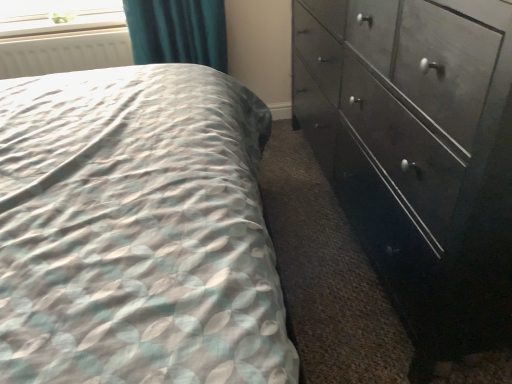
Question: Is dark wood dresser at right far from clear plastic window screen at upper left?

Choices:
 (A) no
 (B) yes

Answer: (B)

Question: Is dark wood dresser at right oriented towards clear plastic window screen at upper left?

Choices:
 (A) no
 (B) yes

Answer: (B)

Question: Can you confirm if dark wood dresser at right is thinner than clear plastic window screen at upper left?

Choices:
 (A) no
 (B) yes

Answer: (A)

Question: Is dark wood dresser at right outside of clear plastic window screen at upper left?

Choices:
 (A) no
 (B) yes

Answer: (B)

Question: Is dark wood dresser at right positioned with its back to clear plastic window screen at upper left?

Choices:
 (A) no
 (B) yes

Answer: (A)

Question: Considering their positions, is clear plastic window screen at upper left located in front of or behind dark wood dresser at right?

Choices:
 (A) behind
 (B) front

Answer: (A)

Question: Based on their sizes in the image, would you say clear plastic window screen at upper left is bigger or smaller than dark wood dresser at right?

Choices:
 (A) small
 (B) big

Answer: (A)

Question: Considering the positions of clear plastic window screen at upper left and dark wood dresser at right in the image, is clear plastic window screen at upper left wider or thinner than dark wood dresser at right?

Choices:
 (A) wide
 (B) thin

Answer: (B)

Question: Would you say clear plastic window screen at upper left is to the left or to the right of dark wood dresser at right in the picture?

Choices:
 (A) right
 (B) left

Answer: (B)

Question: Based on their positions, is white matte radiator at upper left located to the left or right of dark wood dresser at right?

Choices:
 (A) left
 (B) right

Answer: (A)

Question: Considering the positions of point (105, 56) and point (498, 89), is point (105, 56) closer or farther from the camera than point (498, 89)?

Choices:
 (A) closer
 (B) farther

Answer: (B)

Question: Is white matte radiator at upper left wider or thinner than dark wood dresser at right?

Choices:
 (A) thin
 (B) wide

Answer: (A)

Question: From their relative heights in the image, would you say white matte radiator at upper left is taller or shorter than dark wood dresser at right?

Choices:
 (A) tall
 (B) short

Answer: (B)

Question: Considering the positions of point (485, 67) and point (113, 46), is point (485, 67) closer or farther from the camera than point (113, 46)?

Choices:
 (A) closer
 (B) farther

Answer: (A)

Question: In terms of size, does dark wood dresser at right appear bigger or smaller than white matte radiator at upper left?

Choices:
 (A) small
 (B) big

Answer: (B)